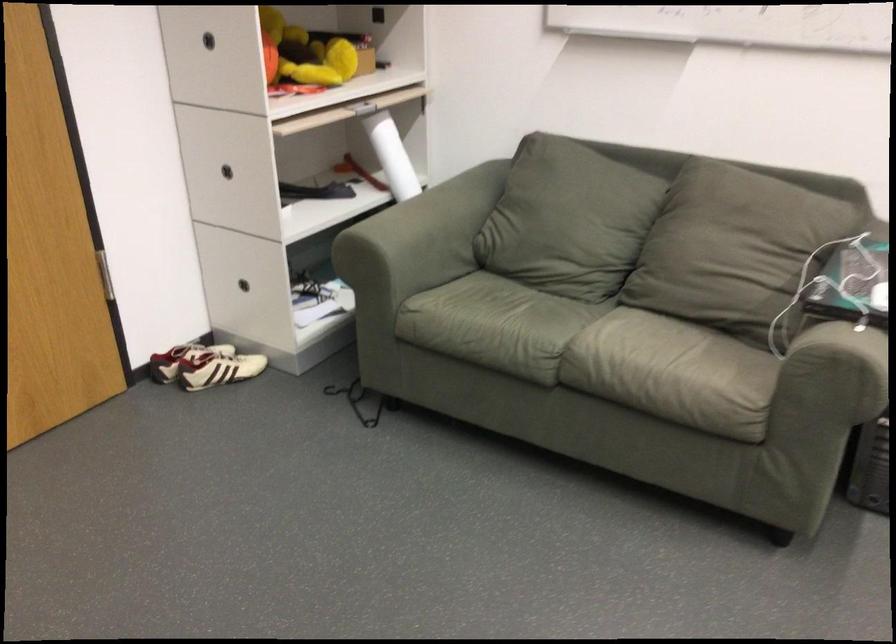
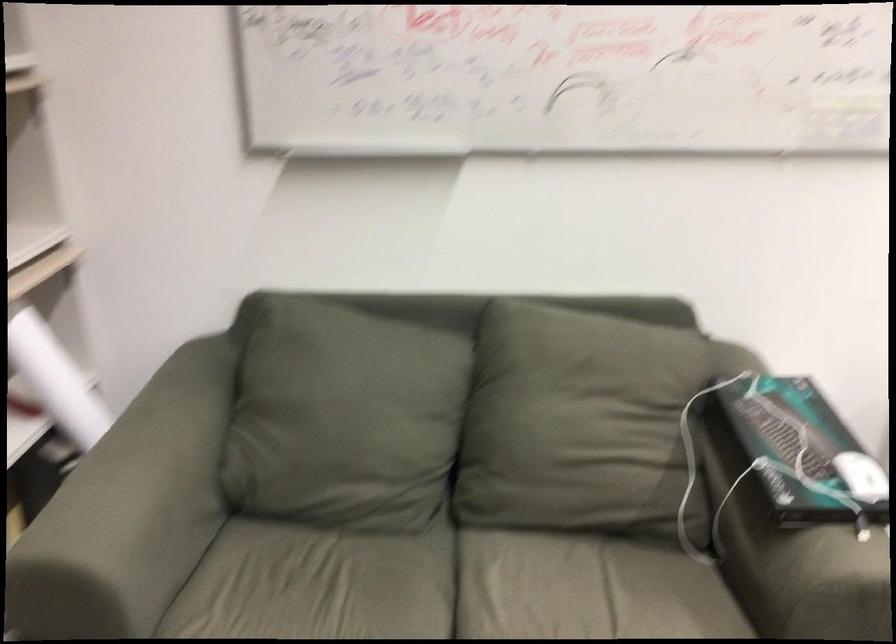
Question: The camera is either moving clockwise (left) or counter-clockwise (right) around the object. The first image is from the beginning of the video and the second image is from the end. Is the camera moving left or right when shooting the video?

Choices:
 (A) Left
 (B) Right

Answer: (A)